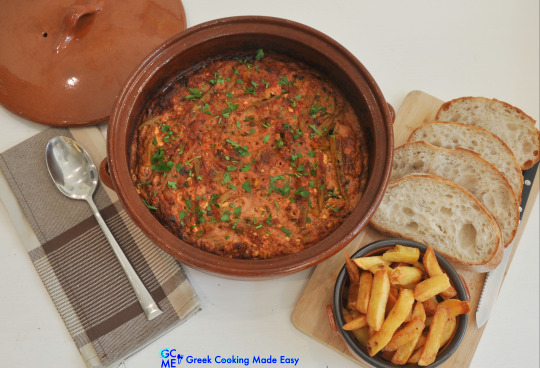
At what (x,y) coordinates should I click in order to perform the action: click on crockpot of food. Please return your answer as a coordinate pair (x, y). The width and height of the screenshot is (540, 368). Looking at the image, I should click on (248, 146).